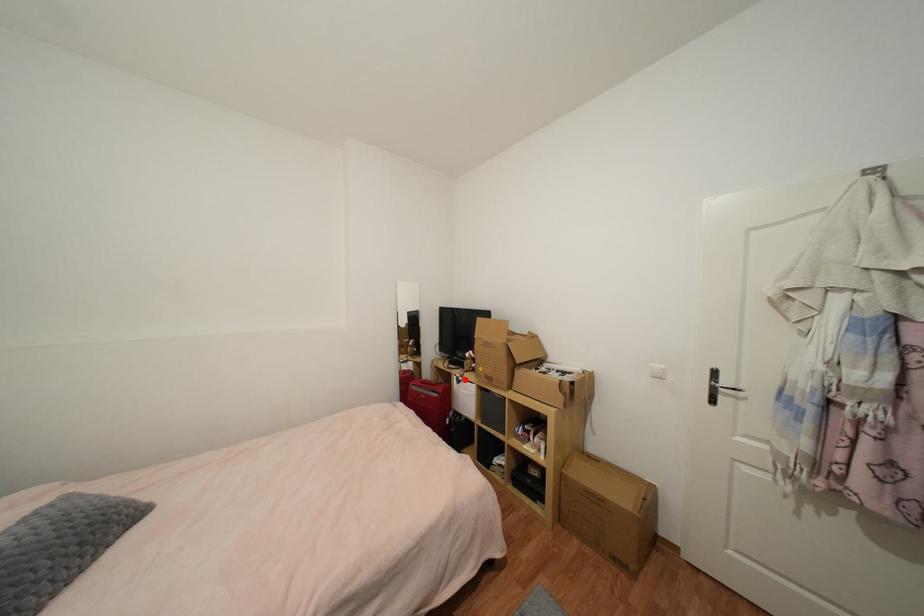
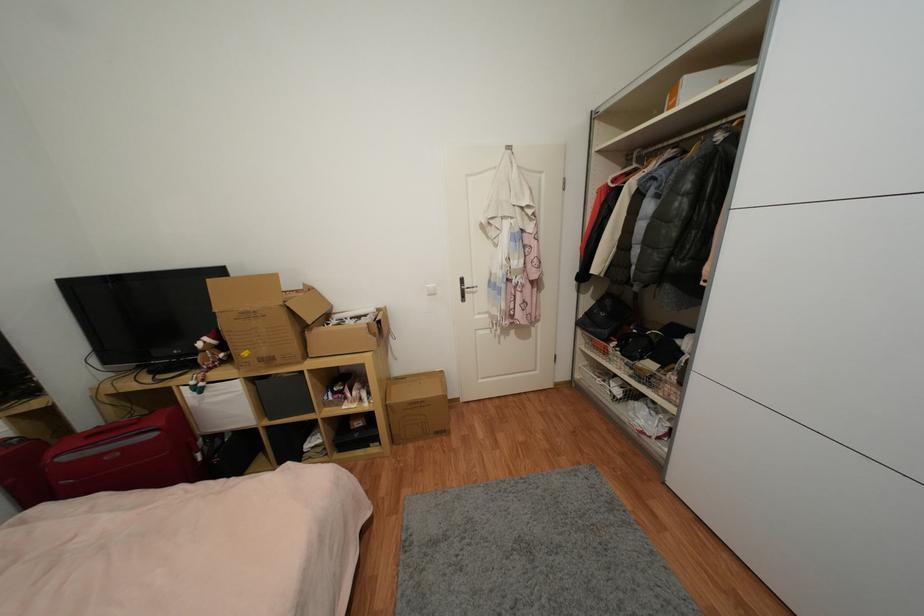
Locate, in the second image, the point that corresponds to the highlighted location in the first image.

(205, 386)